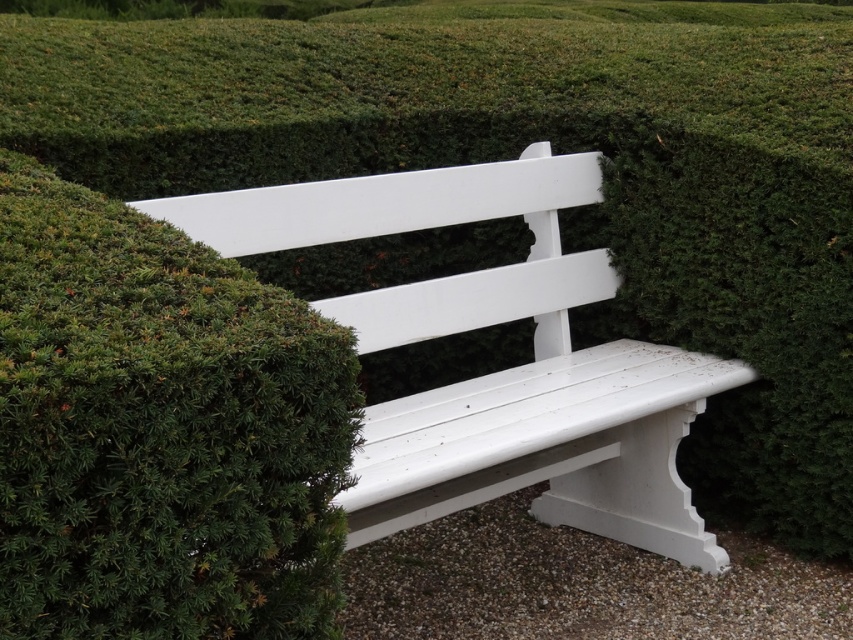
Question: Does green textured shrub at upper left come in front of white painted wood bench at center?

Choices:
 (A) no
 (B) yes

Answer: (B)

Question: Is green textured shrub at upper left to the right of white painted wood bench at center from the viewer's perspective?

Choices:
 (A) no
 (B) yes

Answer: (A)

Question: Which point appears farthest from the camera in this image?

Choices:
 (A) (637, 387)
 (B) (236, 566)

Answer: (A)

Question: Is green textured shrub at upper left to the right of white painted wood bench at center from the viewer's perspective?

Choices:
 (A) no
 (B) yes

Answer: (A)

Question: Among these points, which one is farthest from the camera?

Choices:
 (A) (316, 547)
 (B) (468, 388)

Answer: (B)

Question: Which point appears closest to the camera in this image?

Choices:
 (A) (329, 385)
 (B) (677, 400)

Answer: (A)